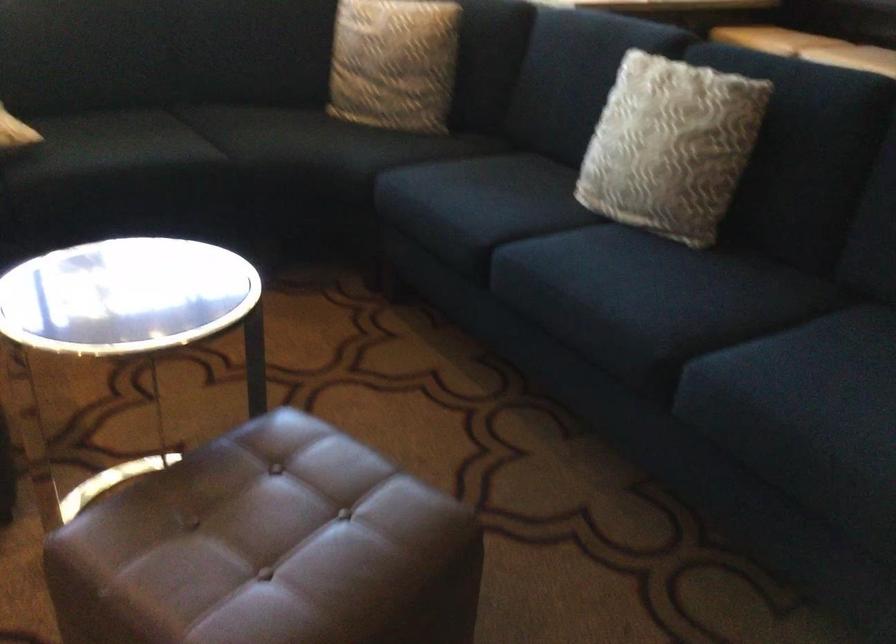
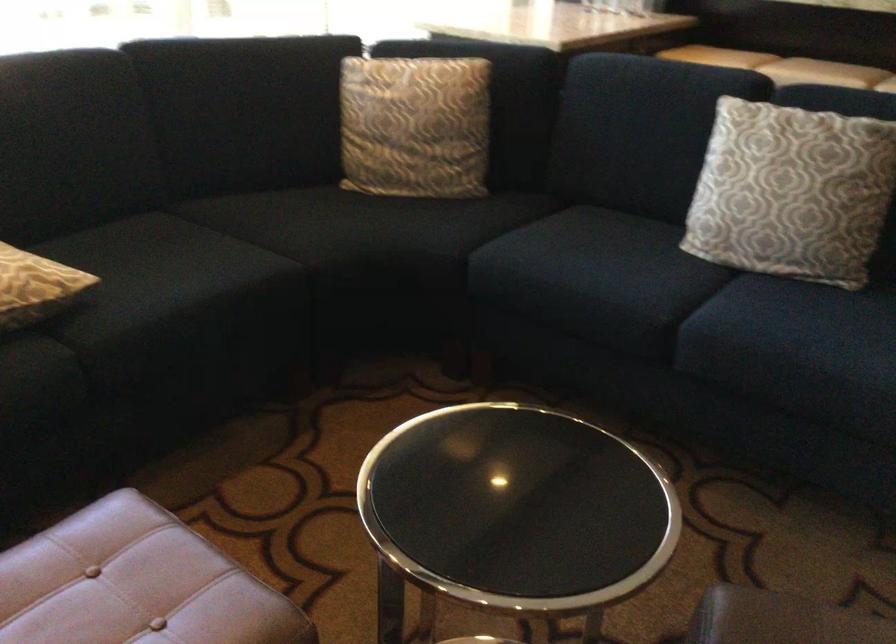
Where in the second image is the point corresponding to point (108, 138) from the first image?

(161, 270)